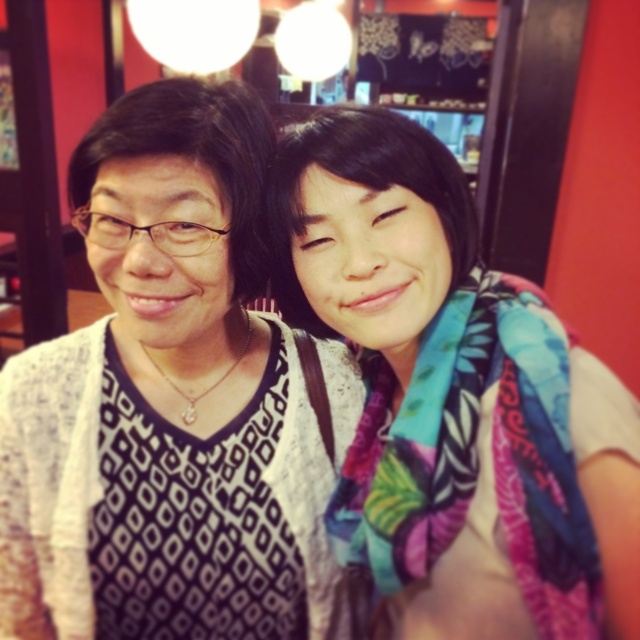
You are a photographer who wants to ensure both the white textured sweater at center and the multicolored scarf at center are clearly visible in the photo. Since the sweater is larger, which item might you need to adjust your focus on to ensure the scarf is also in focus?

The white textured sweater at center is larger in size than the multicolored scarf at center. To ensure both are in focus, adjust the focus to the multicolored scarf at center since it is smaller and might be missed if focusing only on the larger sweater.

You are trying to decide whether to place a rectangular decorative plate that is 12 inches wide between the white textured sweater at center and the multicolored scarf at center. Based on the space between them, will the plate fit?

The white textured sweater at center is wider than the multicolored scarf at center. Since the sweater is wider, the space between them might be sufficient to fit the 12 inch plate, but the exact placement depends on their positioning. However, since the sweater is wider, there is likely enough space to accommodate the plate between them.

You are standing in a cafe and see the white textured sweater at center. Can you estimate its location using coordinates?

The white textured sweater at center is located at coordinates point (166, 401).